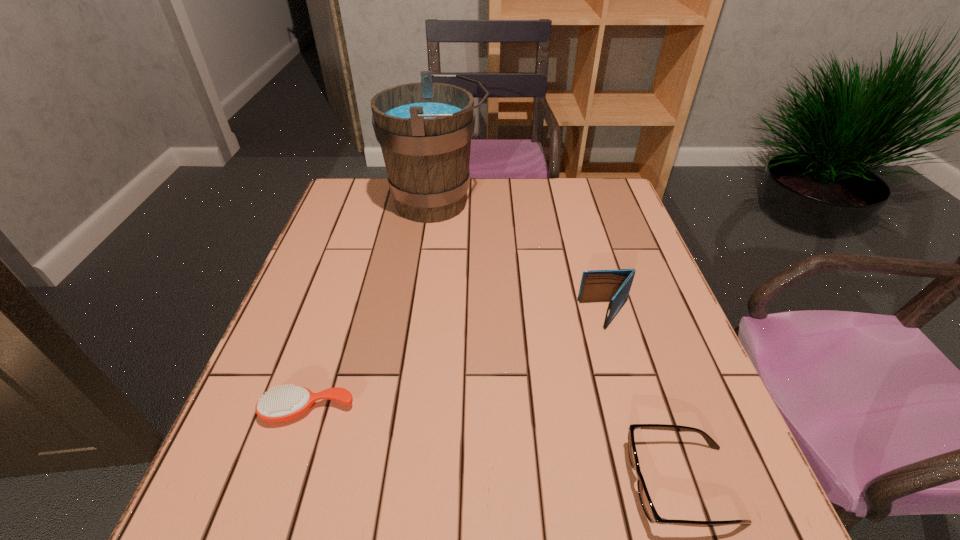
Find the location of `the farthest object`. the farthest object is located at coordinates (424, 129).

At what (x,y) coordinates should I click in order to perform the action: click on the tallest object. Please return your answer as a coordinate pair (x, y). Looking at the image, I should click on (424, 129).

This screenshot has height=540, width=960. I want to click on the third shortest object, so click(614, 286).

Find the location of a particular element. The image size is (960, 540). wallet is located at coordinates tap(614, 286).

Identify the location of the nearest object. (646, 502).

You are a GUI agent. You are given a task and a screenshot of the screen. Output one action in this format:
    pyautogui.click(x=<x>, y=<y>)
    Task: Click on the second shortest object
    The width and height of the screenshot is (960, 540).
    Given the screenshot: What is the action you would take?
    [646, 502]

You are a GUI agent. You are given a task and a screenshot of the screen. Output one action in this format:
    pyautogui.click(x=<x>, y=<y>)
    Task: Click on the shortest object
    Image resolution: width=960 pixels, height=540 pixels.
    Given the screenshot: What is the action you would take?
    pyautogui.click(x=280, y=404)

Locate an element on the screen. The width and height of the screenshot is (960, 540). hairbrush is located at coordinates (280, 404).

The width and height of the screenshot is (960, 540). In order to click on free spot located 0.330m with a handle on the side of the tallest object in this screenshot , I will do `click(595, 203)`.

Where is `vacant region located 0.270m on the exterior surface of the second tallest object`? The height and width of the screenshot is (540, 960). vacant region located 0.270m on the exterior surface of the second tallest object is located at coordinates (463, 315).